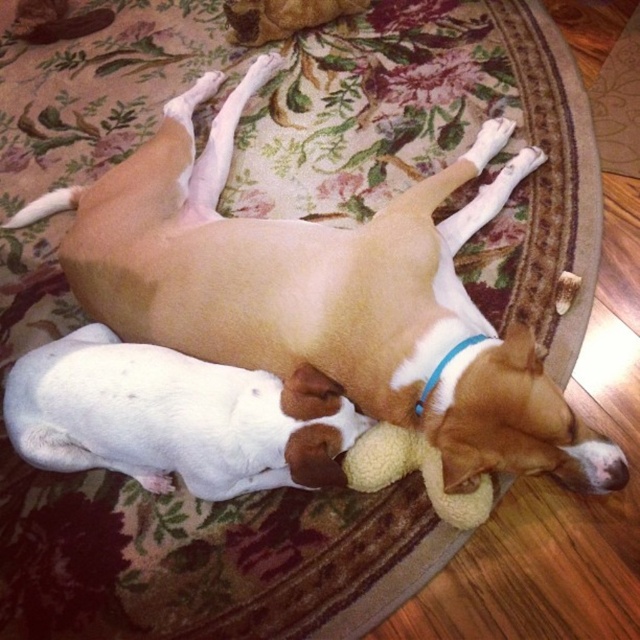
Question: Where is brown matte dog at center located in relation to fluffy yellow toy at lower center in the image?

Choices:
 (A) above
 (B) below

Answer: (A)

Question: Estimate the real-world distances between objects in this image. Which object is closer to the fluffy yellow toy at lower center?

Choices:
 (A) white smooth dog at center
 (B) brown matte dog at center

Answer: (A)

Question: Which of the following is the closest to the observer?

Choices:
 (A) fluffy yellow toy at lower center
 (B) white smooth dog at center
 (C) brown matte dog at center

Answer: (C)

Question: Does brown matte dog at center have a lesser width compared to fluffy yellow toy at lower center?

Choices:
 (A) yes
 (B) no

Answer: (B)

Question: Does brown matte dog at center have a greater width compared to fluffy yellow toy at lower center?

Choices:
 (A) no
 (B) yes

Answer: (B)

Question: Which object is positioned closest to the fluffy yellow toy at lower center?

Choices:
 (A) brown matte dog at center
 (B) white smooth dog at center

Answer: (B)